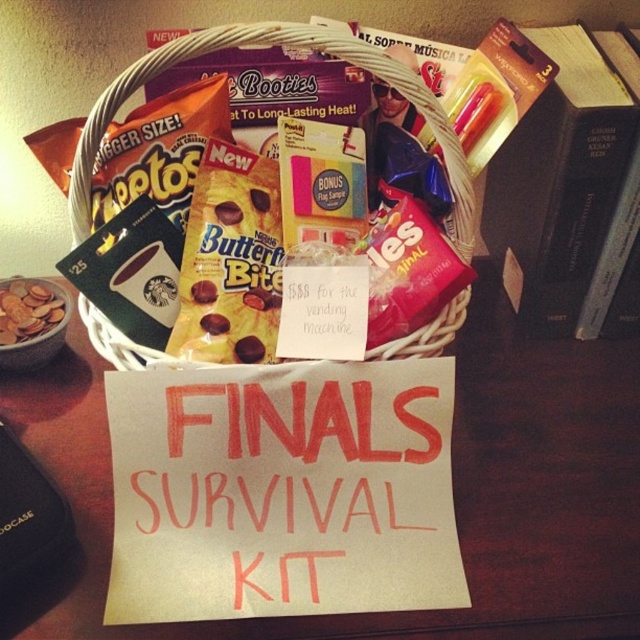
Between point (570, 609) and point (88, 147), which one is positioned behind?

Point (88, 147)

Can you confirm if wooden table at center is positioned to the left of white wicker basket at center?

Incorrect, wooden table at center is not on the left side of white wicker basket at center.

Locate an element on the screen. This screenshot has height=640, width=640. wooden table at center is located at coordinates (452, 486).

The width and height of the screenshot is (640, 640). Describe the element at coordinates (452, 486) in the screenshot. I see `wooden table at center` at that location.

Looking at this image, is wooden table at center below matte brown cookies at lower left?

Correct, wooden table at center is located below matte brown cookies at lower left.

Does point (477, 257) come in front of point (6, 342)?

No, (477, 257) is further to viewer.

Identify the location of wooden table at center. (452, 486).

Is white wicker basket at center below matte brown cookies at lower left?

Incorrect, white wicker basket at center is not positioned below matte brown cookies at lower left.

Does white wicker basket at center have a smaller size compared to matte brown cookies at lower left?

Incorrect, white wicker basket at center is not smaller in size than matte brown cookies at lower left.

This screenshot has width=640, height=640. What do you see at coordinates (275, 44) in the screenshot?
I see `white wicker basket at center` at bounding box center [275, 44].

The image size is (640, 640). Identify the location of white wicker basket at center. (275, 44).